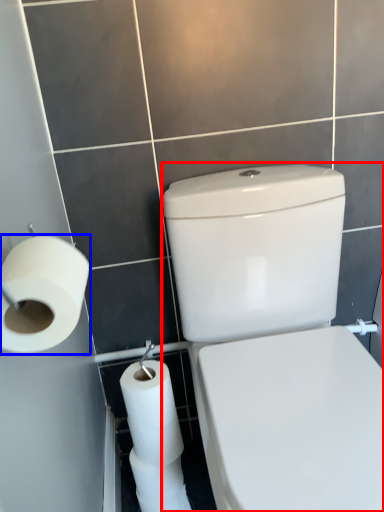
Question: Which object appears farthest to the camera in this image, porcelain (highlighted by a red box) or toilet paper (highlighted by a blue box)?

Choices:
 (A) porcelain
 (B) toilet paper

Answer: (B)